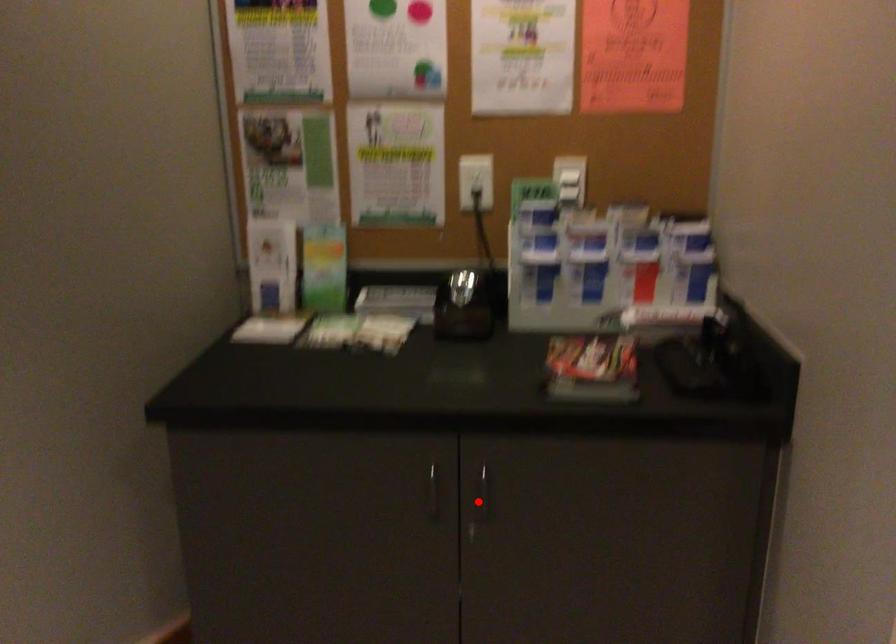
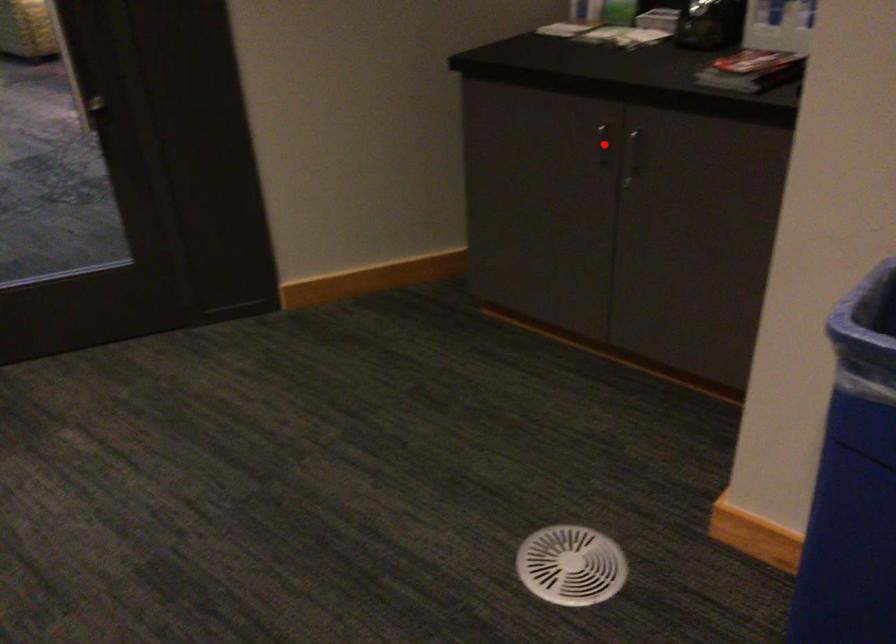
I am providing you with two images of the same scene from different viewpoints. A red point is marked on the first image and another point is marked on the second image. Is the marked point in image1 the same physical position as the marked point in image2?

No